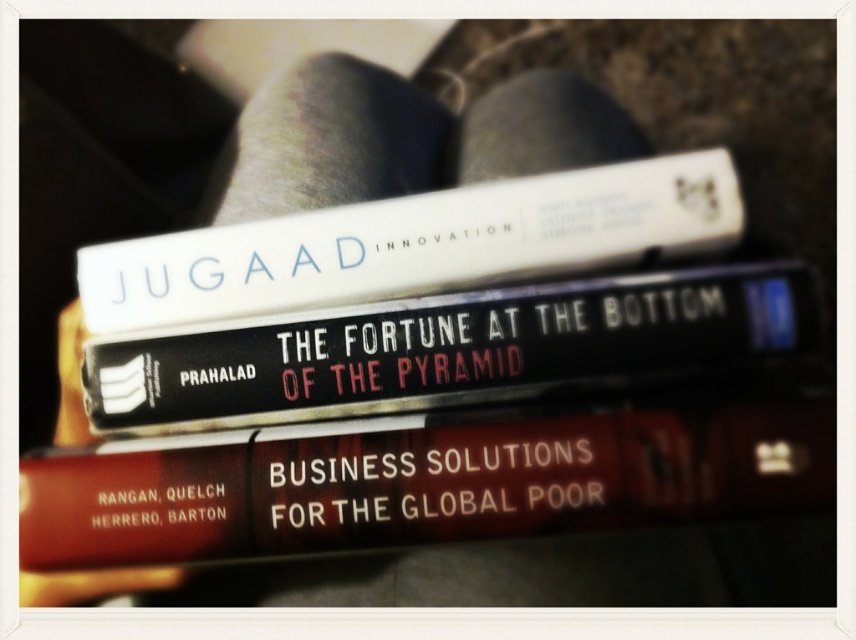
Based on the photo, you are trying to place a 2.5 inch wide book between the red matte book at center and the black matte book at center. Can you fit it there?

The distance between the red matte book at center and the black matte book at center is 1.80 inches. Since the book you want to place is 2.5 inches wide, which is wider than the available space, it won

You are organizing a bookshelf and need to place the red matte book at center and the white matte book at upper center. Given their sizes, which book should be placed at the bottom to ensure stability?

The red matte book at center is larger than the white matte book at upper center, so placing the red matte book at center at the bottom will provide better stability due to its larger size.

You are organizing a bookshelf and need to place the red matte book at center and the black matte book at center. Which book should you place first to ensure stability?

To ensure stability, you should place the red matte book at center first because it is larger in size than the black matte book at center, providing a more stable base for the stack.